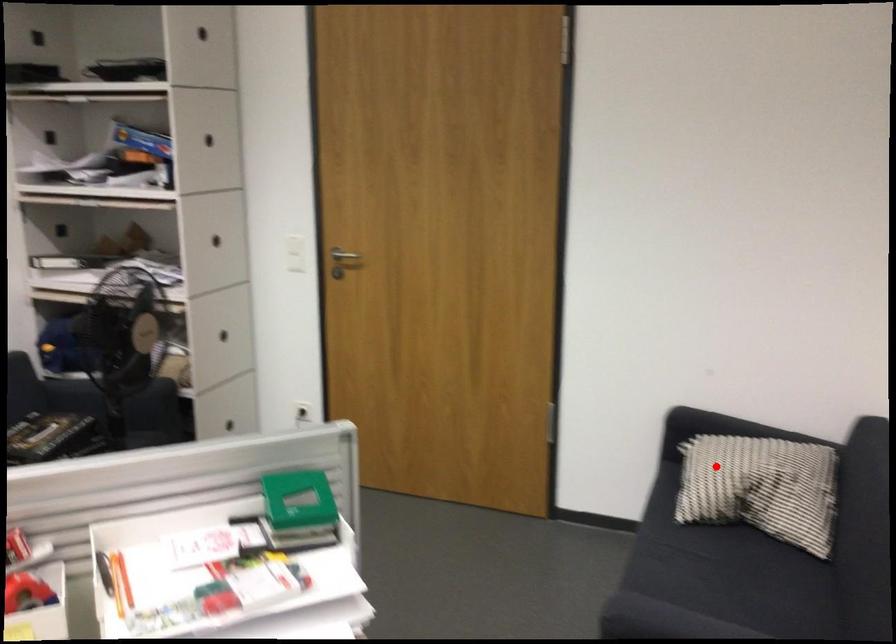
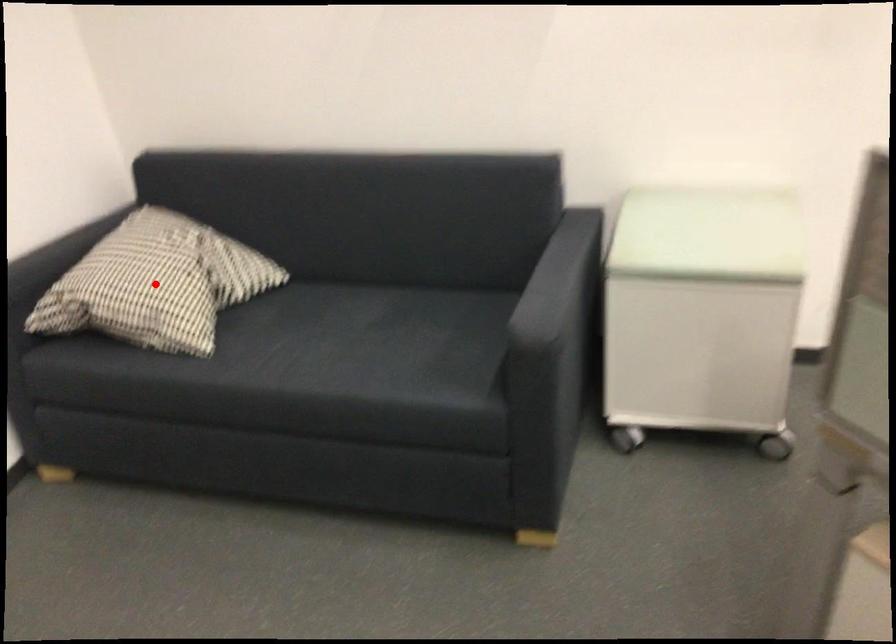
I am providing you with two images of the same scene from different viewpoints. A red point is marked on the first image and another point is marked on the second image. Is the red point in image1 aligned with the point shown in image2?

Yes